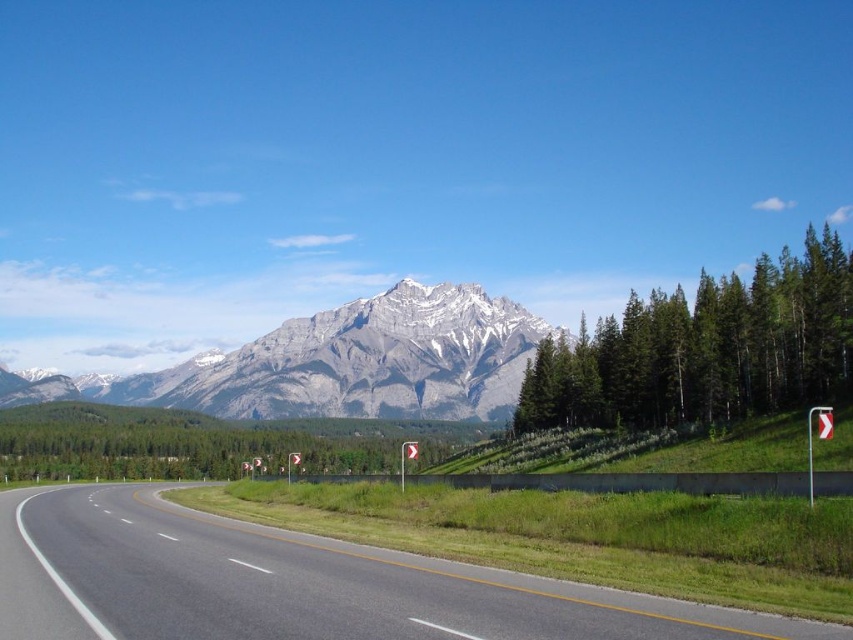
You are a landscape architect designing a new park. You need to place a bench between the green textured tree at center and the green leafy trees at center. Which tree should the bench be closer to if you want it to be near the narrower tree?

The bench should be closer to the green textured tree at center because its width is less than the green leafy trees at center, making it the narrower option.

You are a hiker standing at the lower right of the image, looking towards the mountains. You see the green grass at lower right and the green textured tree at center. Which object is closer to your current position?

The green grass at lower right is closer to your current position because it is positioned under the green textured tree at center, indicating it is in front of the tree.